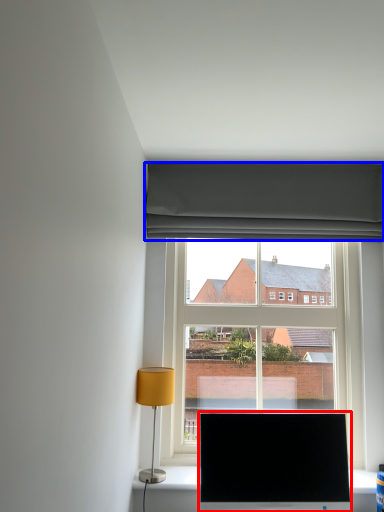
Question: Which object appears farthest to the camera in this image, television (highlighted by a red box) or curtain (highlighted by a blue box)?

Choices:
 (A) television
 (B) curtain

Answer: (B)